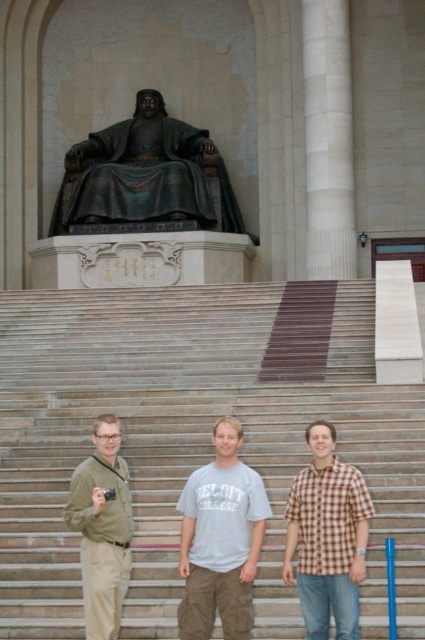
Is smooth stone stairs at center to the left of bronze statue at upper center from the viewer's perspective?

In fact, smooth stone stairs at center is to the right of bronze statue at upper center.

Does smooth stone stairs at center have a lesser width compared to bronze statue at upper center?

No, smooth stone stairs at center is not thinner than bronze statue at upper center.

Does point (130, 628) lie in front of point (91, 160)?

That is True.

The image size is (425, 640). Find the location of `smooth stone stairs at center`. smooth stone stairs at center is located at coordinates (192, 440).

Does bronze statue at upper center appear over brown checkered shirt at center?

Indeed, bronze statue at upper center is positioned over brown checkered shirt at center.

Where is `bronze statue at upper center`? bronze statue at upper center is located at coordinates point(144,177).

Based on the photo, which is above, smooth stone stairs at center or gray cotton t-shirt at center?

smooth stone stairs at center is above.

Identify the location of smooth stone stairs at center. The image size is (425, 640). (x=192, y=440).

Locate an element on the screen. This screenshot has width=425, height=640. smooth stone stairs at center is located at coordinates (192, 440).